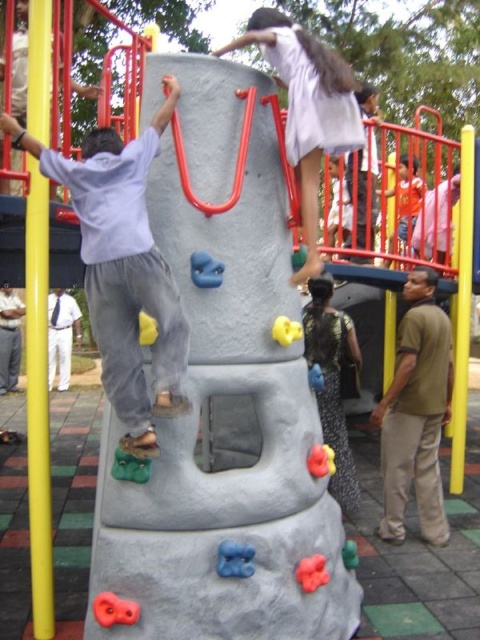
How much distance is there between white cotton pants at lower left and brown leather shirt at lower left?

A distance of 35.67 inches exists between white cotton pants at lower left and brown leather shirt at lower left.

Who is more forward, (54, 308) or (24, 308)?

Point (24, 308) is in front.

Locate an element on the screen. The width and height of the screenshot is (480, 640). white cotton pants at lower left is located at coordinates (61, 336).

How far apart are brown cotton shirt at right and white matte dress at upper center?

brown cotton shirt at right and white matte dress at upper center are 5.77 feet apart from each other.

Which is above, brown cotton shirt at right or white matte dress at upper center?

white matte dress at upper center is higher up.

This screenshot has width=480, height=640. What do you see at coordinates (416, 413) in the screenshot?
I see `brown cotton shirt at right` at bounding box center [416, 413].

You are a GUI agent. You are given a task and a screenshot of the screen. Output one action in this format:
    pyautogui.click(x=<x>, y=<y>)
    Task: Click on the brown cotton shirt at right
    
    Given the screenshot: What is the action you would take?
    pyautogui.click(x=416, y=413)

Which is in front, point (91, 301) or point (298, 33)?

Positioned in front is point (91, 301).

Does point (113, 340) come behind point (309, 72)?

No, (113, 340) is closer to viewer.

I want to click on matte gray climbing wall at center, so click(x=122, y=268).